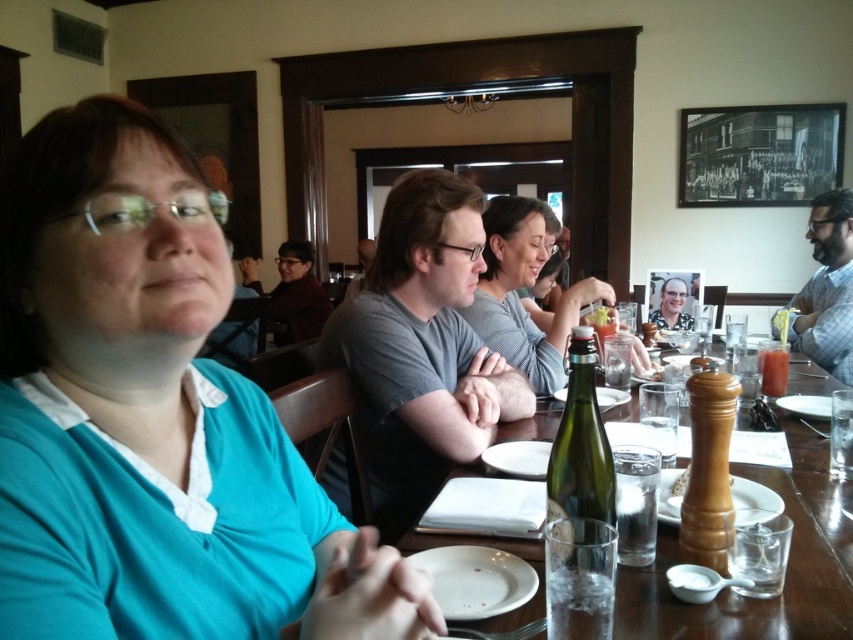
Question: Is teal fabric shirt at center thinner than yellow plastic fork at center?

Choices:
 (A) no
 (B) yes

Answer: (A)

Question: Does teal fabric shirt at center have a larger size compared to matte gray sweater at center?

Choices:
 (A) no
 (B) yes

Answer: (A)

Question: Based on their relative distances, which object is nearer to the teal fabric shirt at center?

Choices:
 (A) matte gray sweater at center
 (B) yellow plastic fork at center

Answer: (A)

Question: Estimate the real-world distances between objects in this image. Which object is farther from the wooden pepper mill at center?

Choices:
 (A) matte black glasses at center
 (B) matte gray sweater at center

Answer: (A)

Question: Which object is farther from the camera taking this photo?

Choices:
 (A) teal fabric shirt at center
 (B) matte gray sweater at center
 (C) yellow plastic fork at center
 (D) wooden table at center

Answer: (C)

Question: Considering the relative positions of teal fabric shirt at center and green glass bottle at center in the image provided, where is teal fabric shirt at center located with respect to green glass bottle at center?

Choices:
 (A) right
 (B) left

Answer: (B)